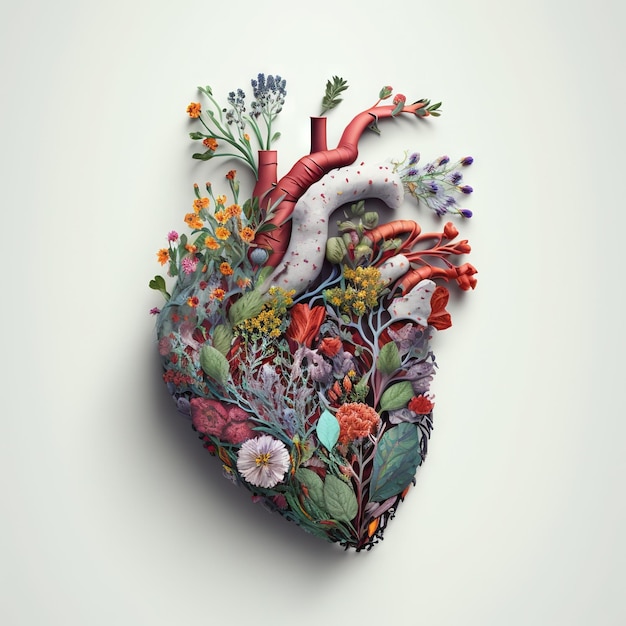
Identify the location of digital art piece. (300, 345).